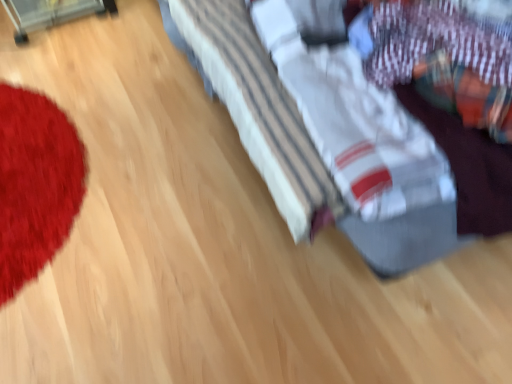
Where is `vacant space behind fluffy red rug at left`? vacant space behind fluffy red rug at left is located at coordinates (88, 59).